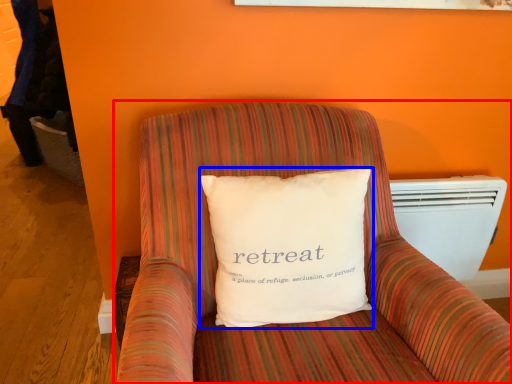
Question: Which of the following is the closest to the observer, furniture (highlighted by a red box) or pillow (highlighted by a blue box)?

Choices:
 (A) furniture
 (B) pillow

Answer: (A)